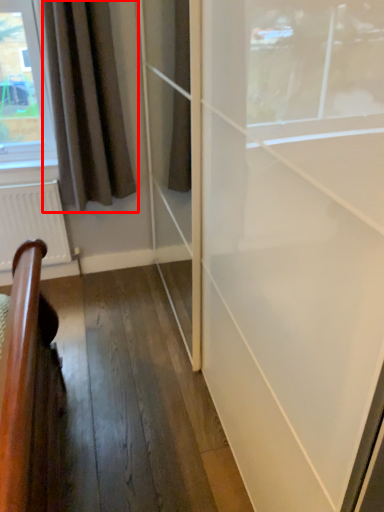
Question: Where is curtain (annotated by the red box) located in relation to radiator in the image?

Choices:
 (A) right
 (B) left

Answer: (A)